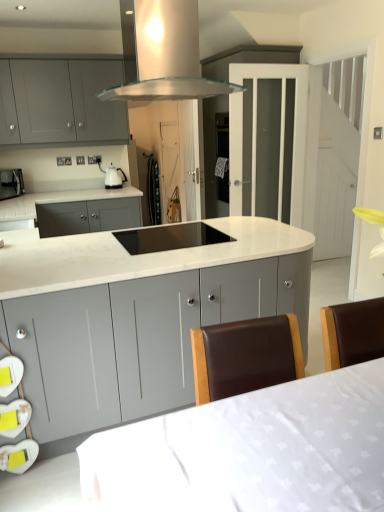
The image size is (384, 512). What are the coordinates of `vacant space situated above white fabric table at lower center (from a real-world perspective)` in the screenshot? It's located at (274, 430).